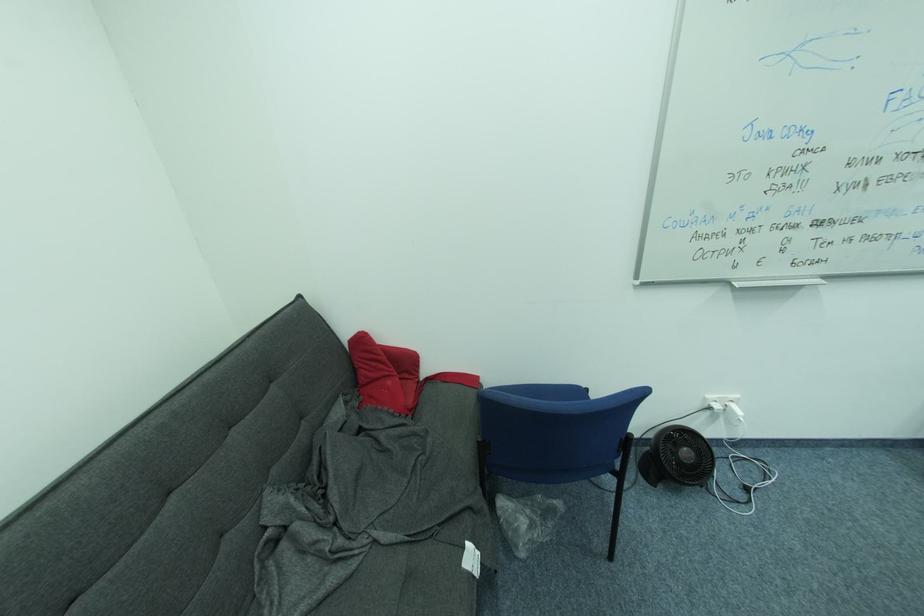
Where would you sit the sofa sitting surface? Please return your answer as a coordinate pair (x, y).

(405, 583)